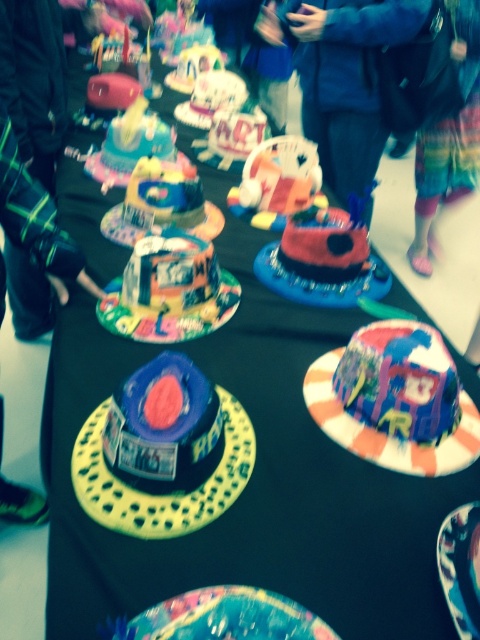
You are at a party and want to take a photo of the matte pink cake at center and the painted cardboard plate at center. Since both are at the center, how can you tell which one is in front?

The matte pink cake at center is closer to the viewer than the painted cardboard plate at center, so it will appear in front in the photo.